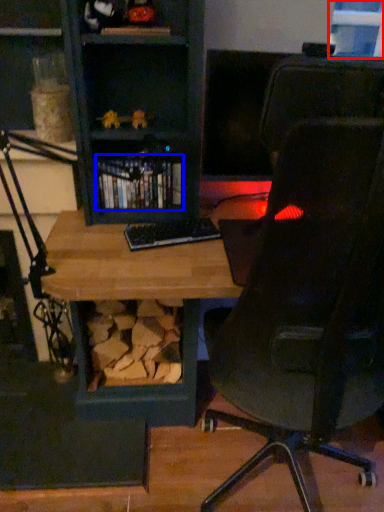
Question: Among these objects, which one is nearest to the camera, window (highlighted by a red box) or book (highlighted by a blue box)?

Choices:
 (A) window
 (B) book

Answer: (B)